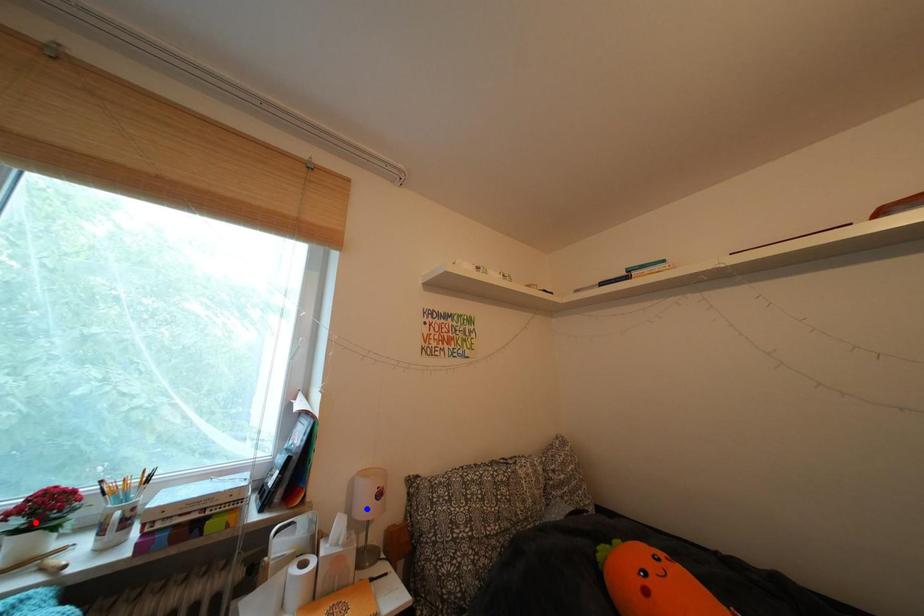
Question: In the image, two points are highlighted. Which point is nearer to the camera? Reply with the corresponding letter.

Choices:
 (A) blue point
 (B) red point

Answer: (B)